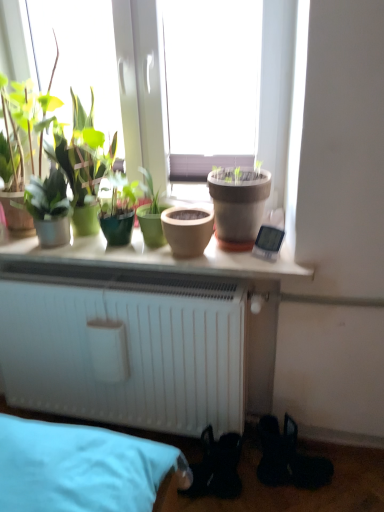
Find the location of `free region under green matte plant at left, which is counted as the 1th houseplant, starting from the left (from a real-world perspective)`. free region under green matte plant at left, which is counted as the 1th houseplant, starting from the left (from a real-world perspective) is located at coordinates (60, 243).